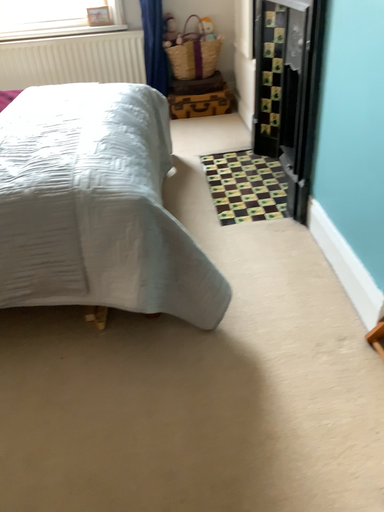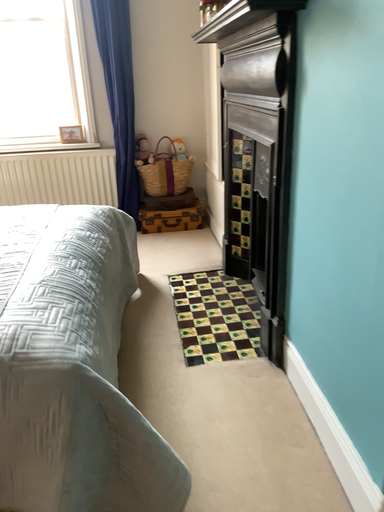
Question: Which way did the camera rotate in the video?

Choices:
 (A) rotated upward
 (B) rotated downward

Answer: (A)